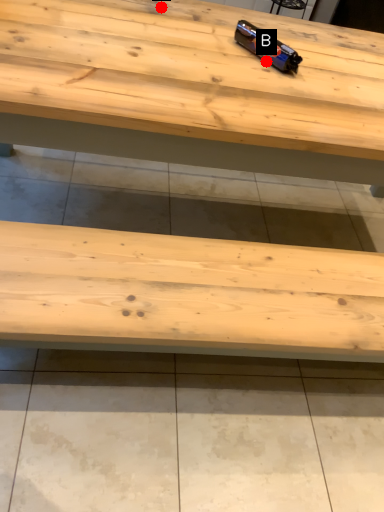
Question: Two points are circled on the image, labeled by A and B beside each circle. Which point is further to the camera?

Choices:
 (A) A is further
 (B) B is further

Answer: (A)